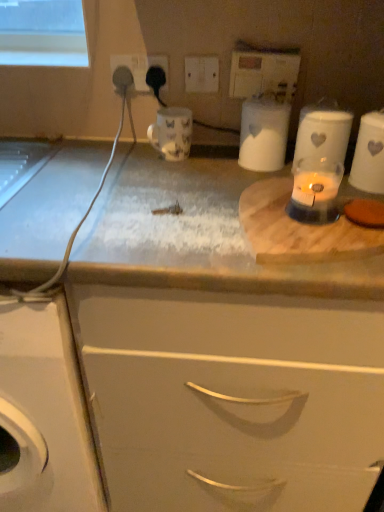
Image resolution: width=384 pixels, height=512 pixels. Find the location of `free area in between translucent glass candle at center and matte ceramic mug at center, which is counted as the first appliance, starting from the left`. free area in between translucent glass candle at center and matte ceramic mug at center, which is counted as the first appliance, starting from the left is located at coordinates (206, 174).